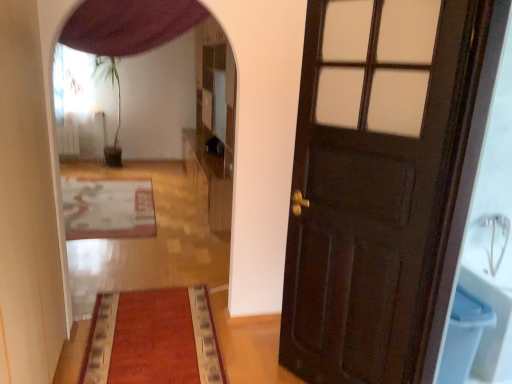
Question: Based on their positions, is velvet red mat at center, which is the 1th mat in front-to-back order, located to the left or right of wooden floor mat at center?

Choices:
 (A) right
 (B) left

Answer: (A)

Question: Is point (157, 374) positioned closer to the camera than point (203, 269)?

Choices:
 (A) closer
 (B) farther

Answer: (A)

Question: Based on their relative distances, which object is farther from the wooden dresser at center?

Choices:
 (A) blue plastic toilet bowl at right
 (B) wooden floor mat at center
 (C) dark wood door at right
 (D) white textured rug at center, positioned as the 2th mat in front-to-back order
 (E) purple fabric curtain at upper center

Answer: (A)

Question: Which object is positioned farthest from the dark wood door at right?

Choices:
 (A) velvet red mat at center, which is the 1th mat in front-to-back order
 (B) white textured rug at center, which is counted as the 1th mat, starting from the back
 (C) wooden dresser at center
 (D) blue plastic toilet bowl at right
 (E) wooden floor mat at center

Answer: (B)